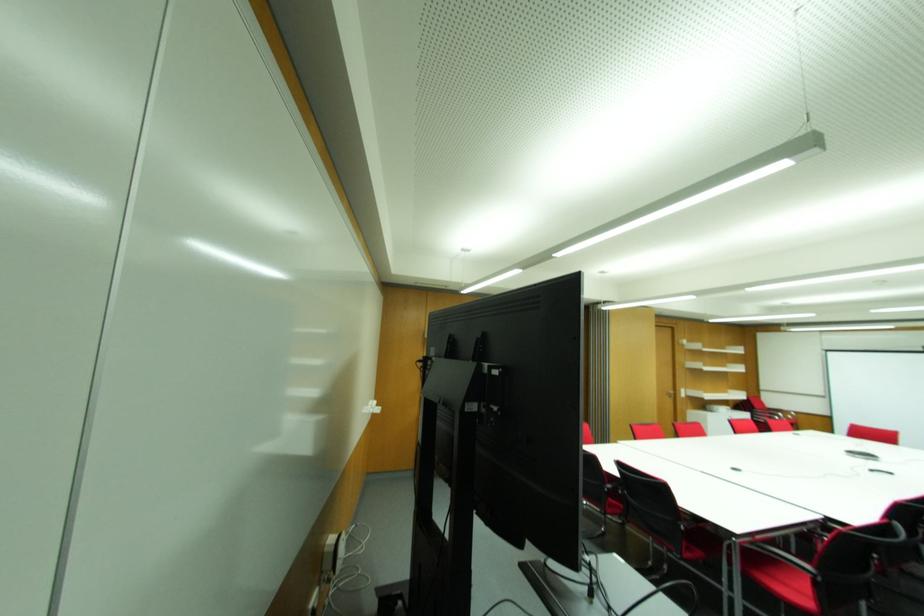
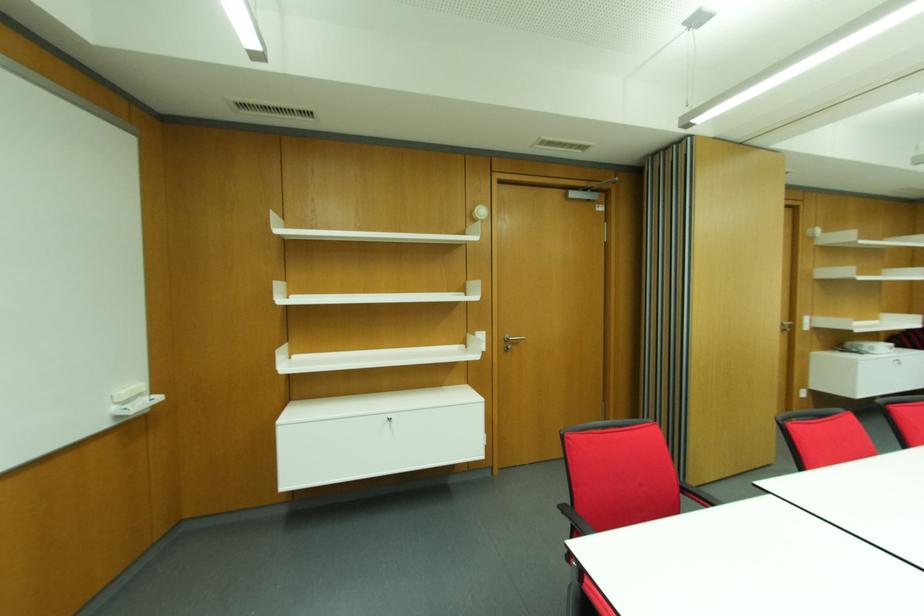
Question: The images are taken continuously from a first-person perspective. In which direction are you moving?

Choices:
 (A) Left
 (B) Right
 (C) Forward
 (D) Backward

Answer: (C)